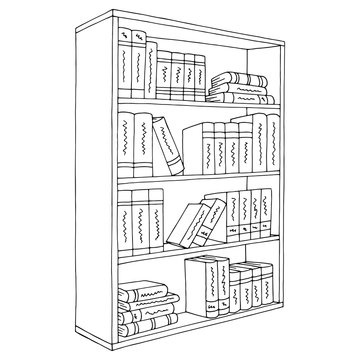
Where is `lying down books`? The image size is (360, 360). lying down books is located at coordinates (137, 291), (136, 304), (137, 313), (143, 327), (246, 76), (243, 85), (242, 97).